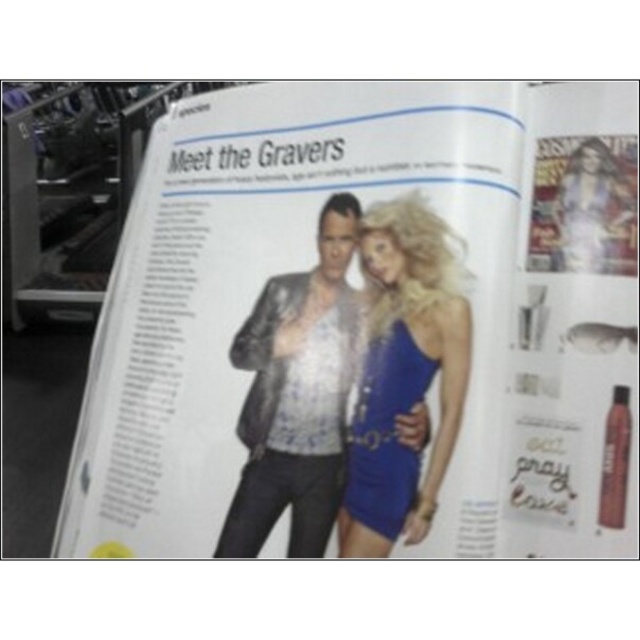
Between shiny black leather jacket at center and shiny blue dress at center, which one appears on the right side from the viewer's perspective?

shiny blue dress at center is more to the right.

Does point (253, 353) come behind point (374, 228)?

That is True.

The height and width of the screenshot is (640, 640). Identify the location of shiny black leather jacket at center. (298, 396).

Is matte black magazine at center in front of shiny black leather jacket at center?

Yes, it is.

Who is shorter, matte black magazine at center or shiny black leather jacket at center?

shiny black leather jacket at center

This screenshot has height=640, width=640. What are the coordinates of `matte black magazine at center` in the screenshot? It's located at (369, 326).

Is matte black magazine at center above shiny blue dress at center?

Yes, matte black magazine at center is above shiny blue dress at center.

Between point (192, 243) and point (394, 234), which one is positioned behind?

Point (192, 243)

Is point (180, 282) less distant than point (445, 225)?

That is False.

The height and width of the screenshot is (640, 640). Identify the location of matte black magazine at center. (369, 326).